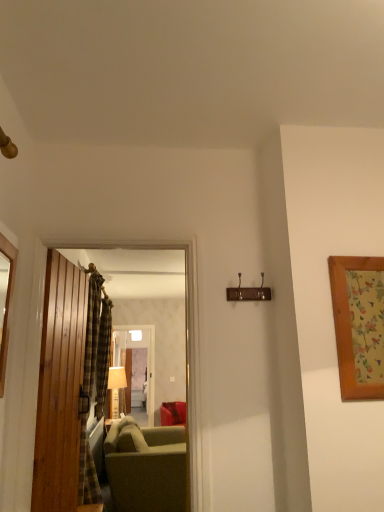
Question: Looking at their shapes, would you say plaid fabric curtain at left, which ranks as the 1th curtain in front-to-back order, is wider or thinner than wooden picture frame at right, arranged as the 1th picture frame when viewed from the right?

Choices:
 (A) wide
 (B) thin

Answer: (A)

Question: Considering the positions of point (97, 334) and point (352, 369), is point (97, 334) closer or farther from the camera than point (352, 369)?

Choices:
 (A) closer
 (B) farther

Answer: (B)

Question: Which object is positioned farthest from the wooden picture frame at right, arranged as the 1th picture frame when viewed from the right?

Choices:
 (A) wooden door at left, acting as the 1th door starting from the left
 (B) velvet green couch at lower center
 (C) transparent glass door at center
 (D) matte beige lamp at center
 (E) wooden mirror at left, marked as the first picture frame in a left-to-right arrangement

Answer: (D)

Question: Estimate the real-world distances between objects in this image. Which object is farther from the wooden picture frame at right, which is the second picture frame from left to right?

Choices:
 (A) plaid fabric curtain at left, the 1th curtain when ordered from right to left
 (B) wooden door at left, acting as the 1th door starting from the left
 (C) plaid fabric curtain at left, arranged as the 2th curtain when viewed from the right
 (D) transparent glass door at center
 (E) matte beige lamp at center

Answer: (E)